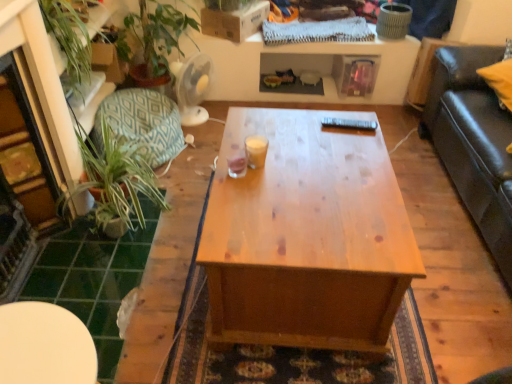
Where is `vacant area located to the right-hand side of translucent glass cup at center, the 2th coffee cup in the left-to-right sequence`? Image resolution: width=512 pixels, height=384 pixels. vacant area located to the right-hand side of translucent glass cup at center, the 2th coffee cup in the left-to-right sequence is located at coordinates (293, 162).